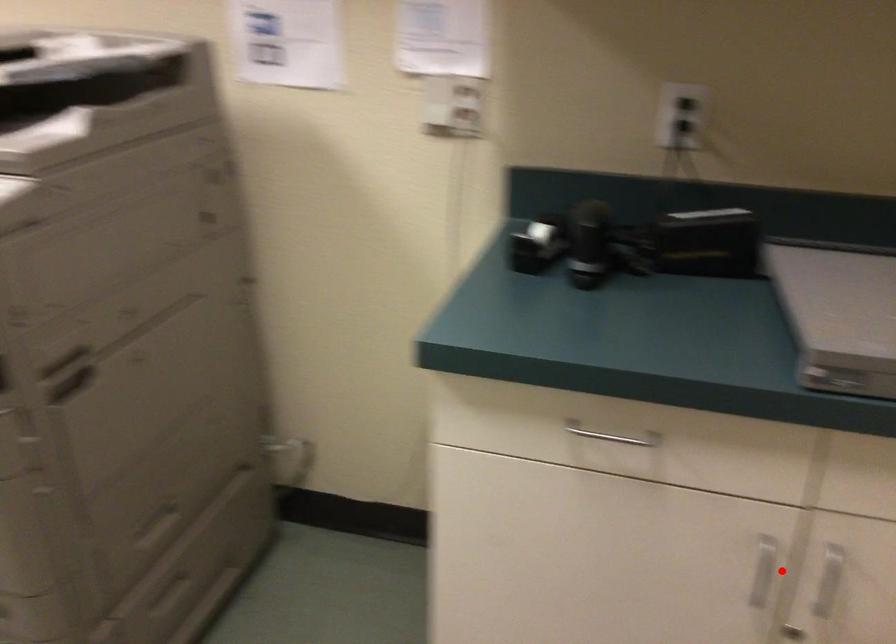
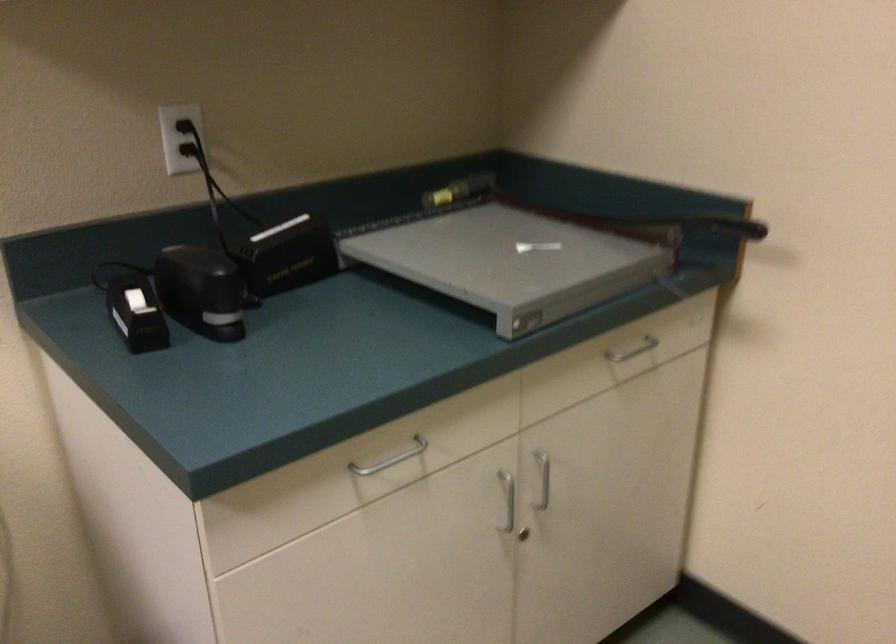
Find the pixel in the second image that matches the highlighted location in the first image.

(507, 500)